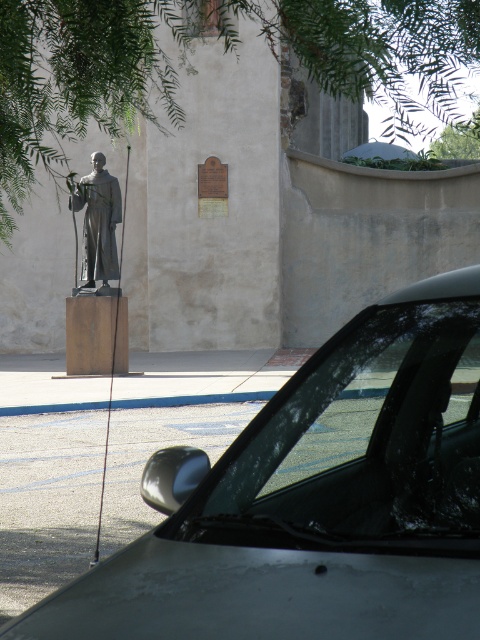
You are standing at the center of the statue. You want to move to the silver metallic car at lower left. What coordinate should you walk to?

You should walk to the coordinate point at [313,502] to reach the silver metallic car at lower left.